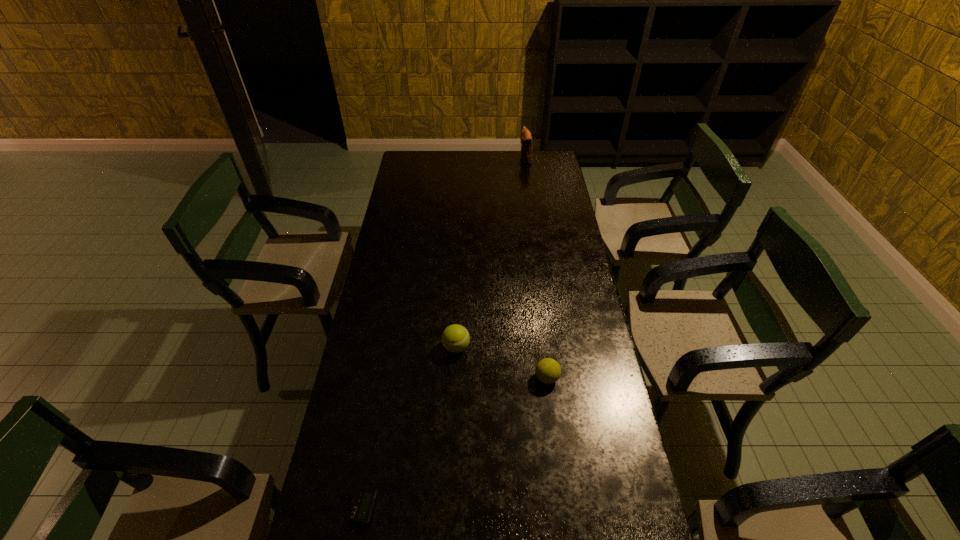
The image size is (960, 540). I want to click on vacant space situated on the open side of the tallest object, so click(463, 159).

Locate an element on the screen. This screenshot has width=960, height=540. vacant area situated 0.160m on the left of the taller tennis ball is located at coordinates [396, 347].

I want to click on free space located on the back of the second nearest object, so click(x=540, y=316).

This screenshot has width=960, height=540. What are the coordinates of `vacant position located on the back of the leftmost object` in the screenshot? It's located at (380, 412).

Image resolution: width=960 pixels, height=540 pixels. Find the location of `object that is positioned at the far edge`. object that is positioned at the far edge is located at coordinates (526, 139).

The width and height of the screenshot is (960, 540). Find the location of `object present at the left edge`. object present at the left edge is located at coordinates (363, 502).

The width and height of the screenshot is (960, 540). I want to click on object that is at the right edge, so click(526, 139).

Where is `object that is positioned at the far right corner`? object that is positioned at the far right corner is located at coordinates (526, 139).

The image size is (960, 540). In the image, there is a desktop. Find the location of `free space at the far edge`. free space at the far edge is located at coordinates (478, 171).

At what (x,y) coordinates should I click in order to perform the action: click on vacant region at the left edge of the desktop. Please return your answer as a coordinate pair (x, y). The image size is (960, 540). Looking at the image, I should click on (402, 266).